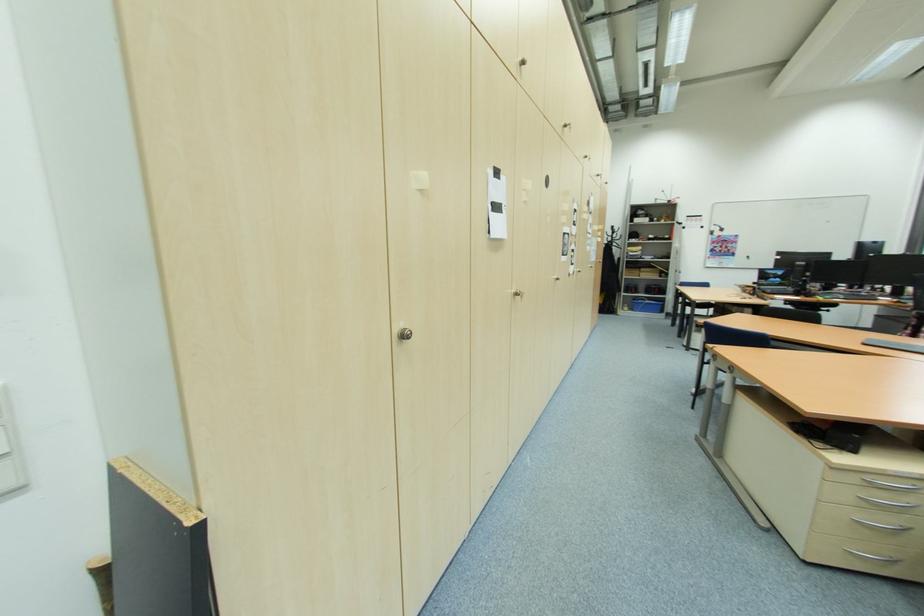
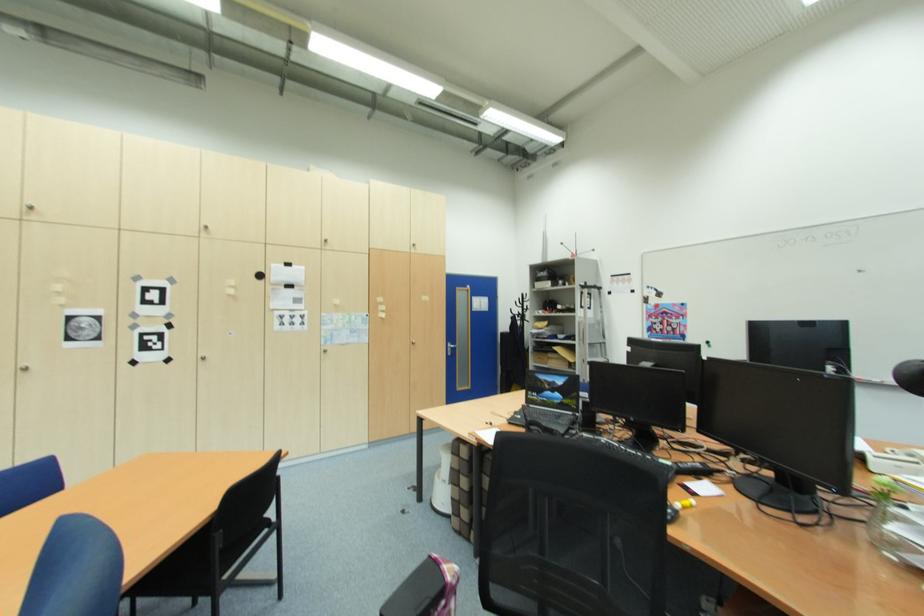
Find the pixel in the second image that matches (x=675, y=244) in the first image.

(578, 317)